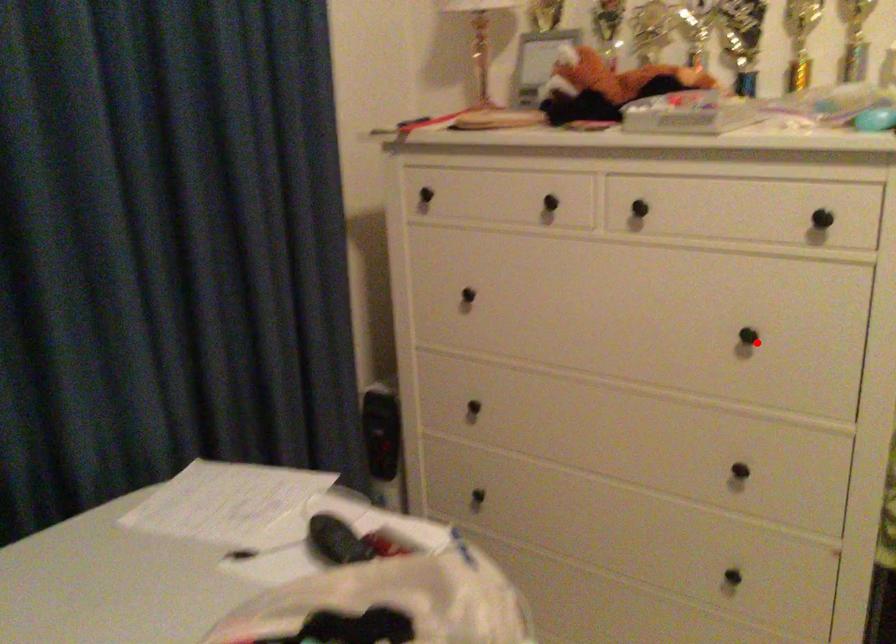
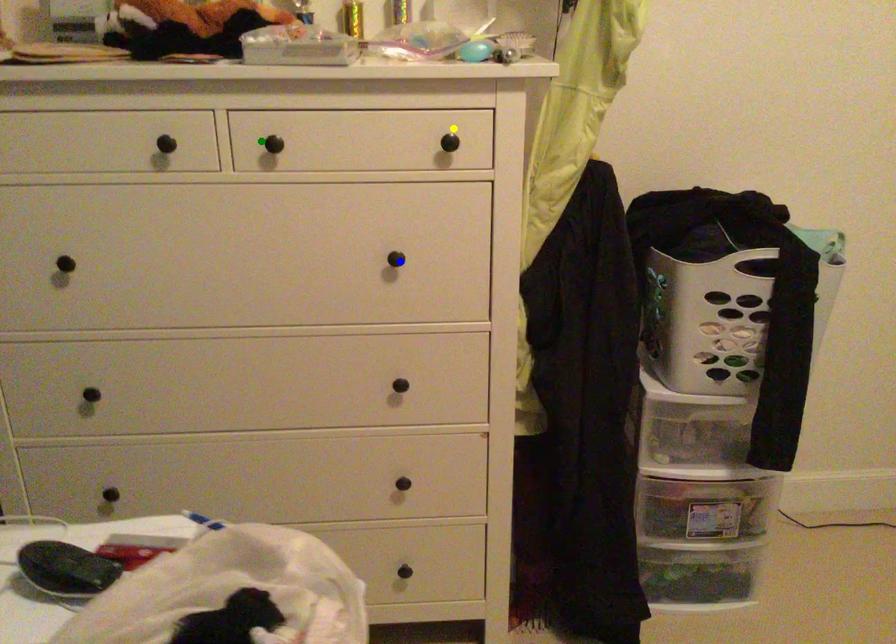
Question: I am providing you with two images of the same scene from different viewpoints. A red point is marked on the first image. You are given multiple points on the second image. Which point in image 2 is actually the same real-world point as the red point in image 1?

Choices:
 (A) green point
 (B) blue point
 (C) yellow point

Answer: (B)